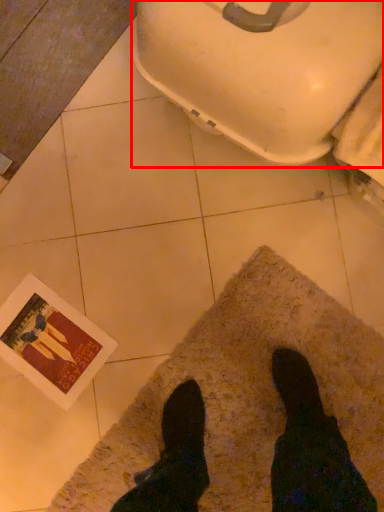
Question: Observing the image, what is the correct spatial positioning of toilet bowl (annotated by the red box) in reference to mat?

Choices:
 (A) right
 (B) left

Answer: (B)